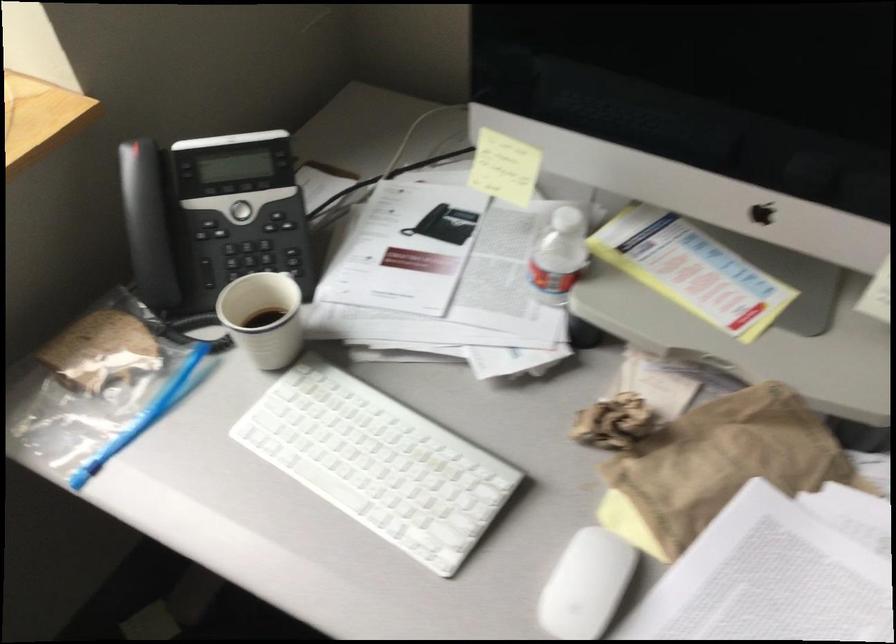
Where would you slid the blue bag slider? Please return your answer as a coordinate pair (x, y).

(173, 384)